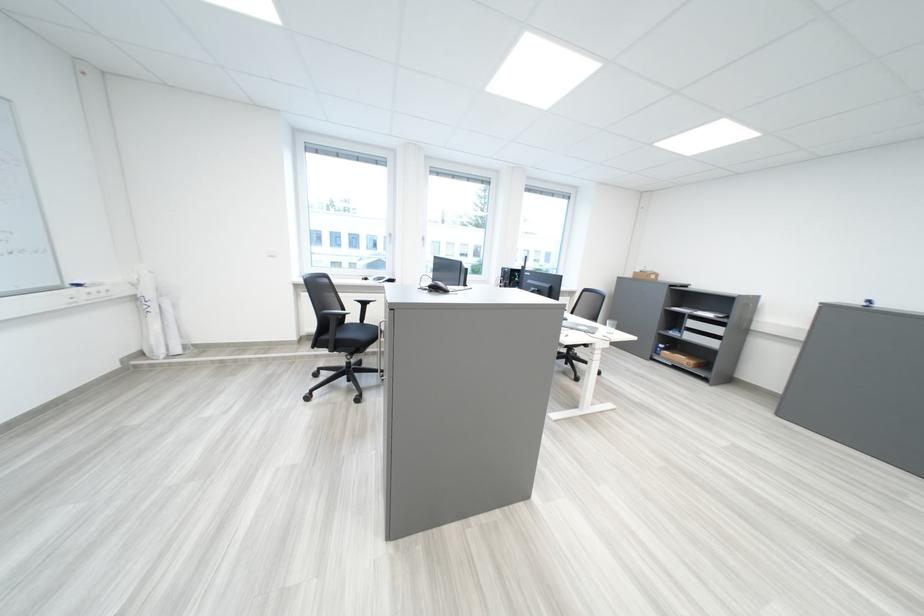
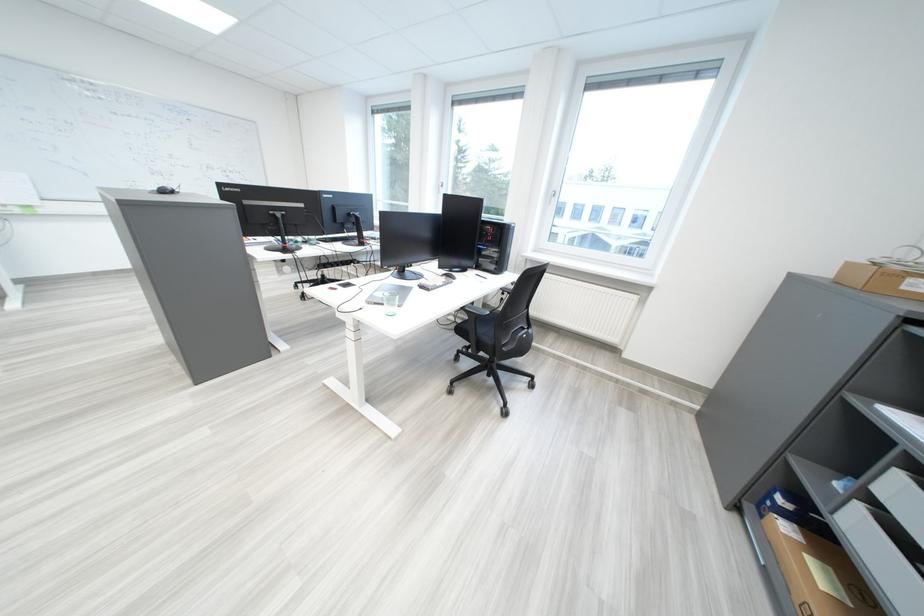
Locate, in the second image, the point that corresponds to the point at 642,277 in the first image.

(839, 274)